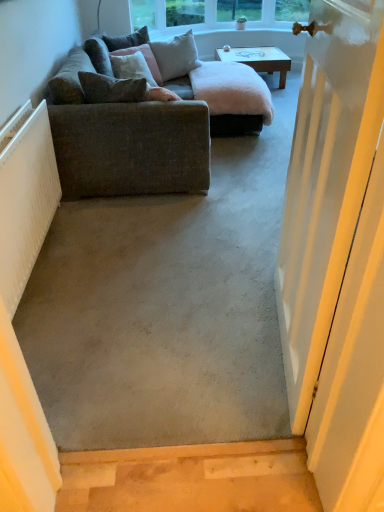
Question: Can you confirm if velvet green pillow at upper left, the fourth pillow from the front, is positioned to the left of velvet brown pillow at upper left, which is counted as the 2th pillow, starting from the front?

Choices:
 (A) yes
 (B) no

Answer: (A)

Question: From the image's perspective, is velvet green pillow at upper left, the fourth pillow from the front, above velvet brown pillow at upper left, which is counted as the 2th pillow, starting from the front?

Choices:
 (A) no
 (B) yes

Answer: (B)

Question: Can you confirm if velvet green pillow at upper left, the 1th pillow in the back-to-front sequence, is smaller than velvet brown pillow at upper left, which is counted as the 2th pillow, starting from the front?

Choices:
 (A) yes
 (B) no

Answer: (A)

Question: From a real-world perspective, is velvet green pillow at upper left, the 1th pillow in the back-to-front sequence, on velvet brown pillow at upper left, which is counted as the 2th pillow, starting from the front?

Choices:
 (A) no
 (B) yes

Answer: (B)

Question: Is velvet green pillow at upper left, the fourth pillow from the front, positioned in front of velvet brown pillow at upper left, which is counted as the 2th pillow, starting from the front?

Choices:
 (A) yes
 (B) no

Answer: (B)

Question: From the image's perspective, relative to white painted wood door at right, is velvet brown pillow at upper left, which is the 3th pillow from back to front, above or below?

Choices:
 (A) above
 (B) below

Answer: (A)

Question: From a real-world perspective, is velvet brown pillow at upper left, which is counted as the 2th pillow, starting from the front, physically located above or below white painted wood door at right?

Choices:
 (A) below
 (B) above

Answer: (A)

Question: Considering the positions of velvet brown pillow at upper left, which is counted as the 2th pillow, starting from the front, and white painted wood door at right in the image, is velvet brown pillow at upper left, which is counted as the 2th pillow, starting from the front, taller or shorter than white painted wood door at right?

Choices:
 (A) tall
 (B) short

Answer: (B)

Question: Visually, is velvet brown pillow at upper left, which is the 3th pillow from back to front, positioned to the left or to the right of white painted wood door at right?

Choices:
 (A) right
 (B) left

Answer: (B)

Question: Looking at the image, does light gray fabric pillow at upper center, positioned as the 2th pillow in back-to-front order, seem bigger or smaller compared to wooden coffee table at center?

Choices:
 (A) small
 (B) big

Answer: (A)

Question: Is light gray fabric pillow at upper center, which is counted as the third pillow, starting from the front, wider or thinner than wooden coffee table at center?

Choices:
 (A) wide
 (B) thin

Answer: (B)

Question: Is light gray fabric pillow at upper center, which is counted as the third pillow, starting from the front, inside the boundaries of wooden coffee table at center, or outside?

Choices:
 (A) inside
 (B) outside

Answer: (B)

Question: From a real-world perspective, is light gray fabric pillow at upper center, which is counted as the third pillow, starting from the front, physically located above or below wooden coffee table at center?

Choices:
 (A) above
 (B) below

Answer: (A)

Question: Considering the positions of white ribbed radiator at left and light gray fabric pillow at upper center, positioned as the 2th pillow in back-to-front order, in the image, is white ribbed radiator at left wider or thinner than light gray fabric pillow at upper center, positioned as the 2th pillow in back-to-front order,?

Choices:
 (A) thin
 (B) wide

Answer: (A)

Question: In terms of size, does white ribbed radiator at left appear bigger or smaller than light gray fabric pillow at upper center, which is counted as the third pillow, starting from the front?

Choices:
 (A) big
 (B) small

Answer: (B)